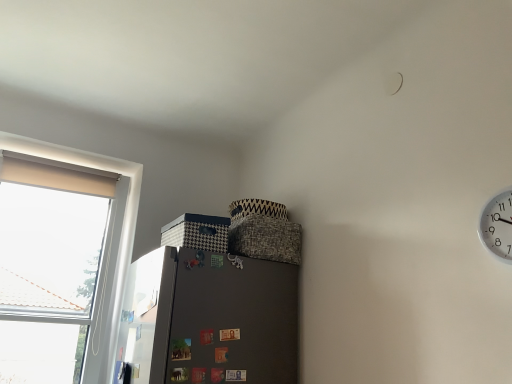
Question: Choose the correct answer: Is white plastic clock at upper right inside metallic silver screen door at left or outside it?

Choices:
 (A) inside
 (B) outside

Answer: (B)

Question: In terms of size, does white plastic clock at upper right appear bigger or smaller than metallic silver screen door at left?

Choices:
 (A) big
 (B) small

Answer: (B)

Question: Estimate the real-world distances between objects in this image. Which object is closer to the metallic silver screen door at left?

Choices:
 (A) white plastic clock at upper right
 (B) white fabric window at left

Answer: (B)

Question: Which of these objects is positioned closest to the metallic silver screen door at left?

Choices:
 (A) white plastic clock at upper right
 (B) white fabric window at left

Answer: (B)